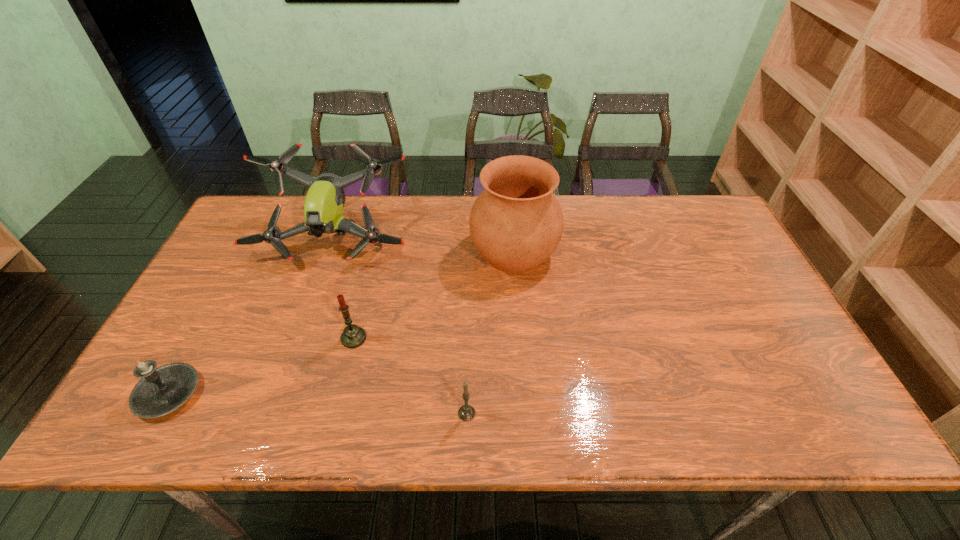
The image size is (960, 540). What are the coordinates of `free space located 0.330m on the left of the rightmost candle` in the screenshot? It's located at (308, 413).

Locate an element on the screen. This screenshot has height=540, width=960. pottery located at the far edge is located at coordinates (516, 223).

At what (x,y) coordinates should I click in order to perform the action: click on drone situated at the far edge. Please return your answer as a coordinate pair (x, y). Looking at the image, I should click on (323, 208).

At what (x,y) coordinates should I click in order to perform the action: click on drone that is at the left edge. Please return your answer as a coordinate pair (x, y). Image resolution: width=960 pixels, height=540 pixels. Looking at the image, I should click on (323, 208).

Locate an element on the screen. candle at the left edge is located at coordinates (161, 390).

The width and height of the screenshot is (960, 540). In order to click on object that is at the far left corner in this screenshot , I will do `click(323, 208)`.

Locate an element on the screen. This screenshot has width=960, height=540. object at the near left corner is located at coordinates (161, 390).

This screenshot has height=540, width=960. What are the coordinates of `blank area at the far edge` in the screenshot? It's located at (615, 201).

The image size is (960, 540). I want to click on free region at the near edge of the desktop, so click(x=400, y=399).

The height and width of the screenshot is (540, 960). Identify the location of vacant space at the right edge. (701, 260).